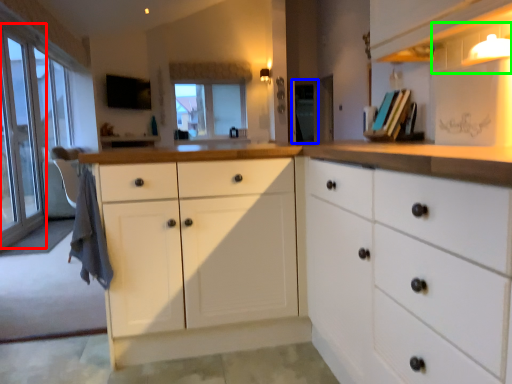
Question: Estimate the real-world distances between objects in this image. Which object is closer to glass door (highlighted by a red box), screen door (highlighted by a blue box) or shelf (highlighted by a green box)?

Choices:
 (A) screen door
 (B) shelf

Answer: (A)